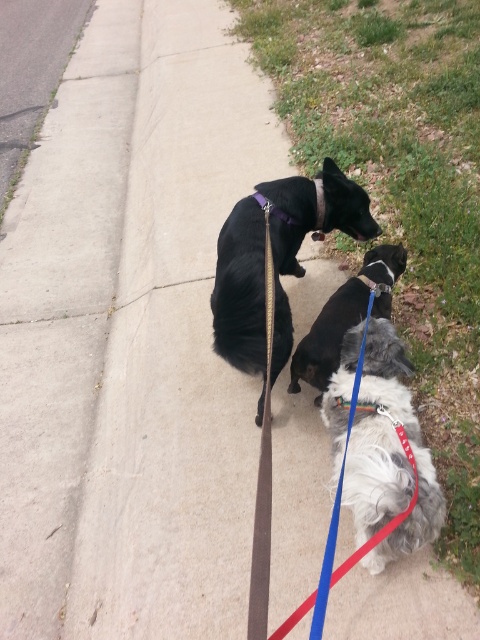
You are a dog trainer observing the scene. You need to determine which dog is closer to you. The dogs are the black matte dog at center and the purple fabric neckband at upper center. Which one is closer?

The black matte dog at center is closer to you because it is in front of the purple fabric neckband at upper center.